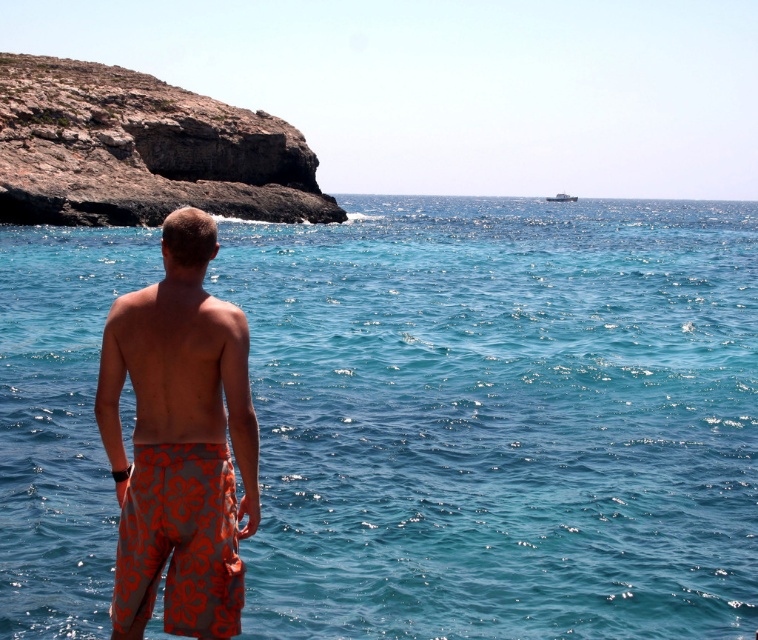
Between translucent blue water at center and orange printed shorts at lower center, which one is positioned lower?

orange printed shorts at lower center is lower down.

How far apart are translucent blue water at center and orange printed shorts at lower center?

They are 18.83 meters apart.

Who is more forward, (600, 228) or (143, 465)?

Positioned in front is point (143, 465).

Find the location of a particular element. The image size is (758, 640). translucent blue water at center is located at coordinates (500, 417).

In the scene shown: Can you confirm if orange printed shorts at center is wider than orange printed shorts at lower center?

Correct, the width of orange printed shorts at center exceeds that of orange printed shorts at lower center.

Can you confirm if orange printed shorts at center is positioned above orange printed shorts at lower center?

Yes, orange printed shorts at center is above orange printed shorts at lower center.

Measure the distance between point (193, 328) and camera.

A distance of 6.88 meters exists between point (193, 328) and camera.

I want to click on orange printed shorts at center, so click(x=179, y=442).

Does orange printed shorts at center have a lesser width compared to rugged brown rock at upper left?

Yes, orange printed shorts at center is thinner than rugged brown rock at upper left.

Which is behind, point (199, 269) or point (133, 189)?

The point (133, 189) is more distant.

The width and height of the screenshot is (758, 640). I want to click on orange printed shorts at center, so click(179, 442).